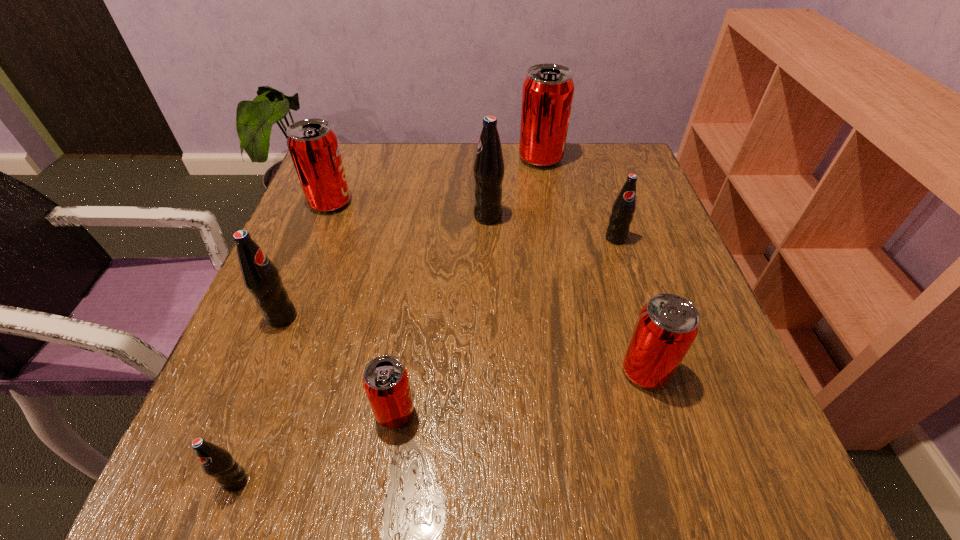
The height and width of the screenshot is (540, 960). I want to click on free space located on the front of the leftmost red soda can, so click(x=282, y=326).

Where is `vacant space located on the front label of the fourth nearest object`? vacant space located on the front label of the fourth nearest object is located at coordinates (330, 317).

I want to click on vacant space located 0.050m on the front label of the rightmost black pop, so click(623, 262).

The width and height of the screenshot is (960, 540). I want to click on vacant area located 0.340m on the left of the third nearest pop, so click(411, 371).

This screenshot has height=540, width=960. Identify the location of free space located 0.220m on the left of the second nearest pop. (228, 413).

The image size is (960, 540). What are the coordinates of `object that is at the near edge` in the screenshot? It's located at (218, 463).

Find the location of a particular element. object at the far left corner is located at coordinates (313, 145).

What are the coordinates of `object present at the near left corner` in the screenshot? It's located at (218, 463).

At what (x,y) coordinates should I click in order to perform the action: click on vacant position at the far edge of the desktop. Please return your answer as a coordinate pair (x, y). This screenshot has height=540, width=960. Looking at the image, I should click on (509, 172).

In the image, there is a desktop. At what (x,y) coordinates should I click in order to perform the action: click on vacant region at the left edge. Please return your answer as a coordinate pair (x, y). The height and width of the screenshot is (540, 960). Looking at the image, I should click on (288, 240).